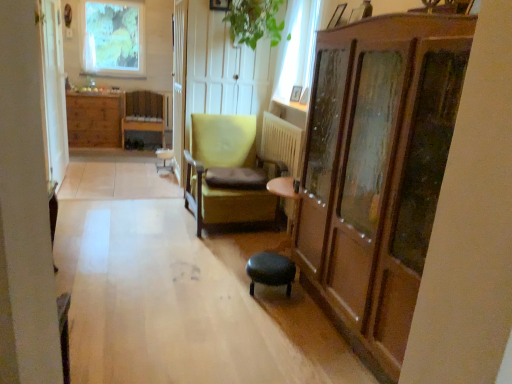
The image size is (512, 384). In order to click on blank space above black leather stool at center (from a real-world perspective) in this screenshot , I will do `click(274, 263)`.